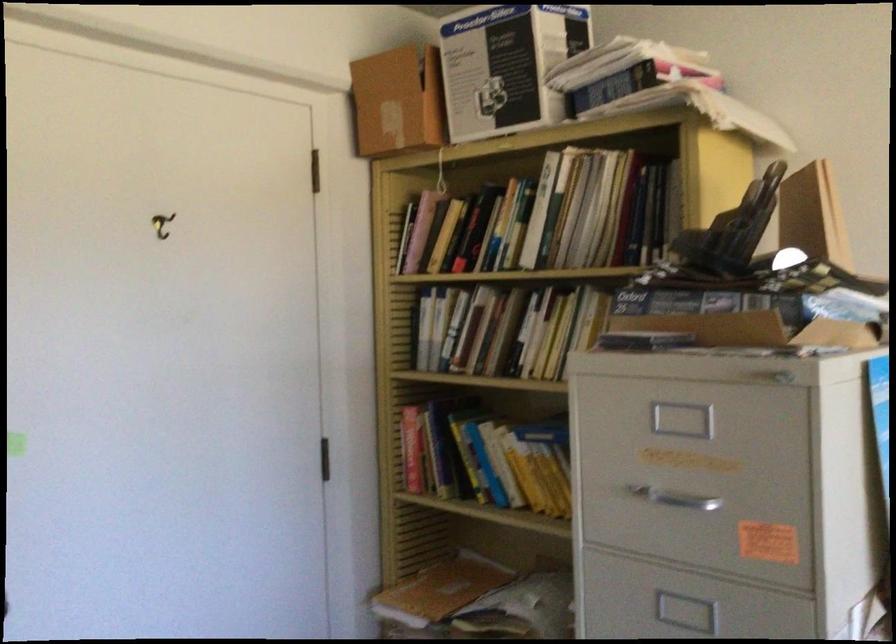
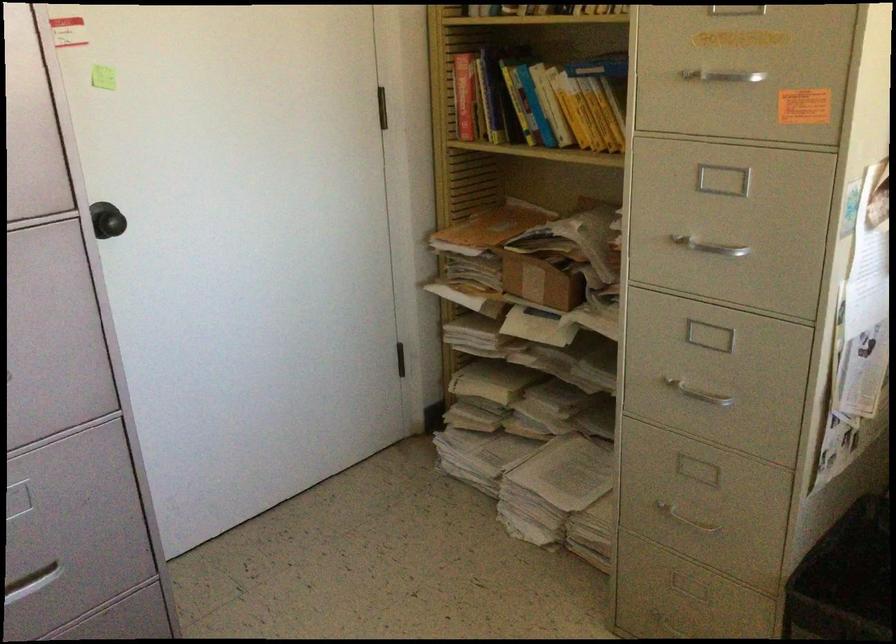
Locate, in the second image, the point that corresponds to point (541, 478) in the first image.

(590, 114)